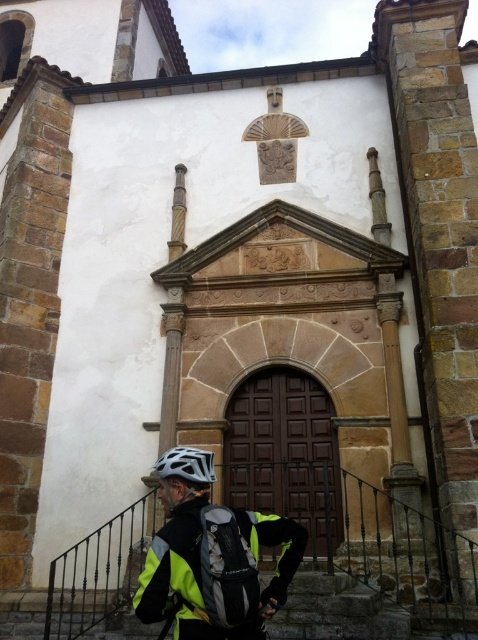
Is yellow reflective jacket at lower center above white matte bicycle helmet at lower center?

Incorrect, yellow reflective jacket at lower center is not positioned above white matte bicycle helmet at lower center.

Can you confirm if yellow reflective jacket at lower center is shorter than white matte bicycle helmet at lower center?

Incorrect, yellow reflective jacket at lower center's height does not fall short of white matte bicycle helmet at lower center's.

What do you see at coordinates (212, 556) in the screenshot?
I see `yellow reflective jacket at lower center` at bounding box center [212, 556].

The width and height of the screenshot is (478, 640). In order to click on yellow reflective jacket at lower center in this screenshot , I will do `click(212, 556)`.